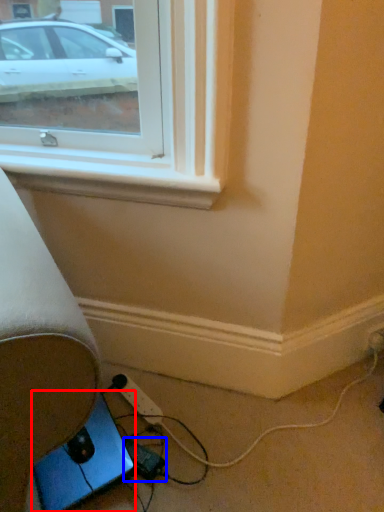
Question: Which object appears closest to the camera in this image, gadget (highlighted by a red box) or extension cord (highlighted by a blue box)?

Choices:
 (A) gadget
 (B) extension cord

Answer: (A)